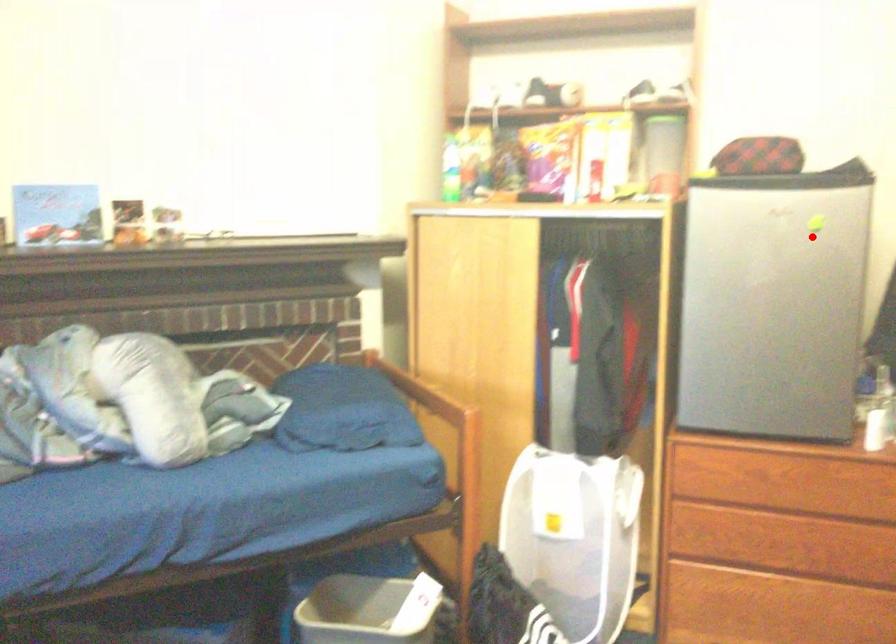
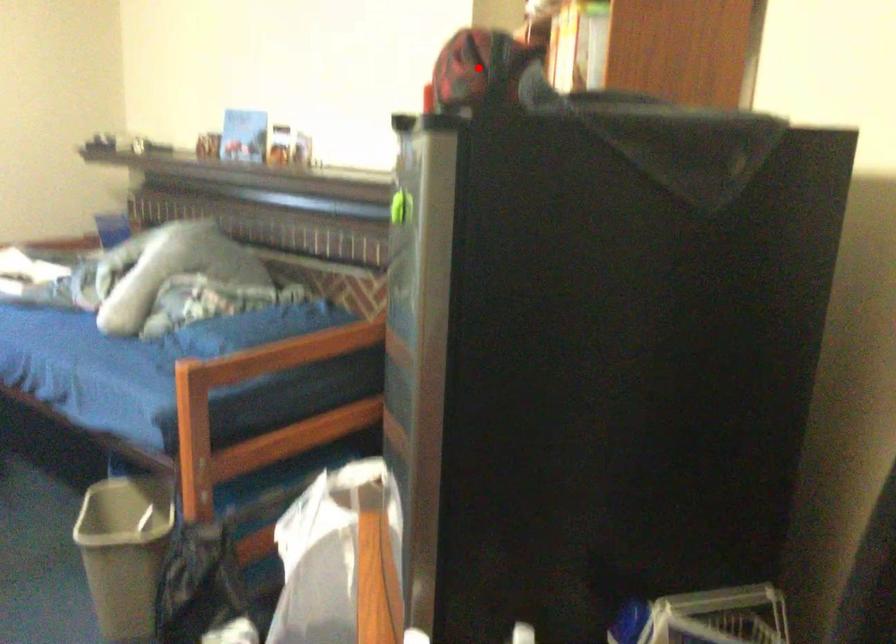
I am providing you with two images of the same scene from different viewpoints. A red point is marked on the first image and another point is marked on the second image. Do the highlighted points in image1 and image2 indicate the same real-world spot?

No